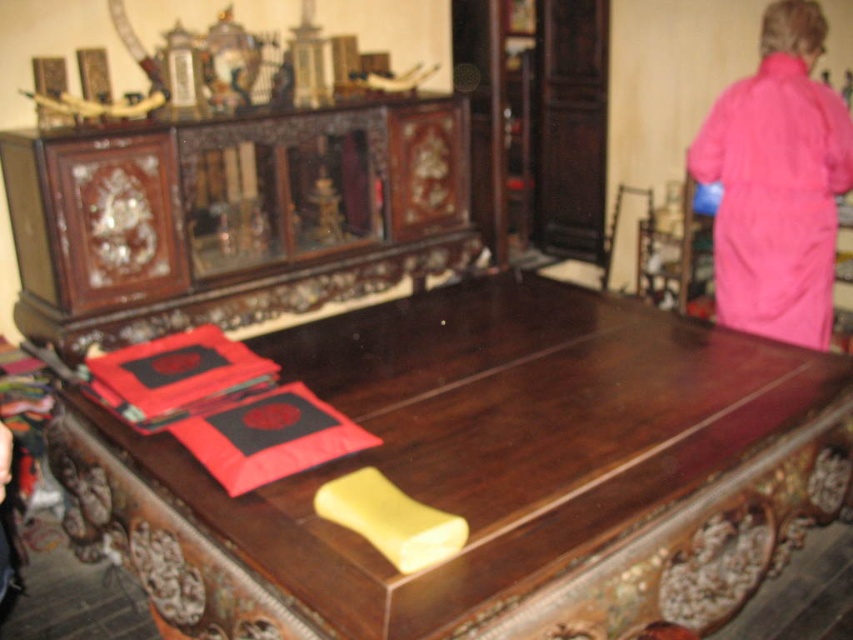
Question: Which point appears farthest from the camera in this image?

Choices:
 (A) (715, 308)
 (B) (364, 212)
 (C) (155, 346)
 (D) (438, 362)

Answer: (A)

Question: Among these objects, which one is farthest from the camera?

Choices:
 (A) dark brown polished wood cabinet at center
 (B) pink fabric robe at upper right
 (C) polished wood table at center

Answer: (A)

Question: Considering the relative positions of pink fabric robe at upper right and matte red fabric at left in the image provided, where is pink fabric robe at upper right located with respect to matte red fabric at left?

Choices:
 (A) left
 (B) right

Answer: (B)

Question: Which is farther from the pink fabric robe at upper right?

Choices:
 (A) polished wood table at center
 (B) dark brown polished wood cabinet at center
 (C) matte red fabric at left

Answer: (C)

Question: Can you confirm if dark brown polished wood cabinet at center is thinner than matte red fabric at left?

Choices:
 (A) yes
 (B) no

Answer: (B)

Question: Can you confirm if polished wood table at center is wider than dark brown polished wood cabinet at center?

Choices:
 (A) yes
 (B) no

Answer: (A)